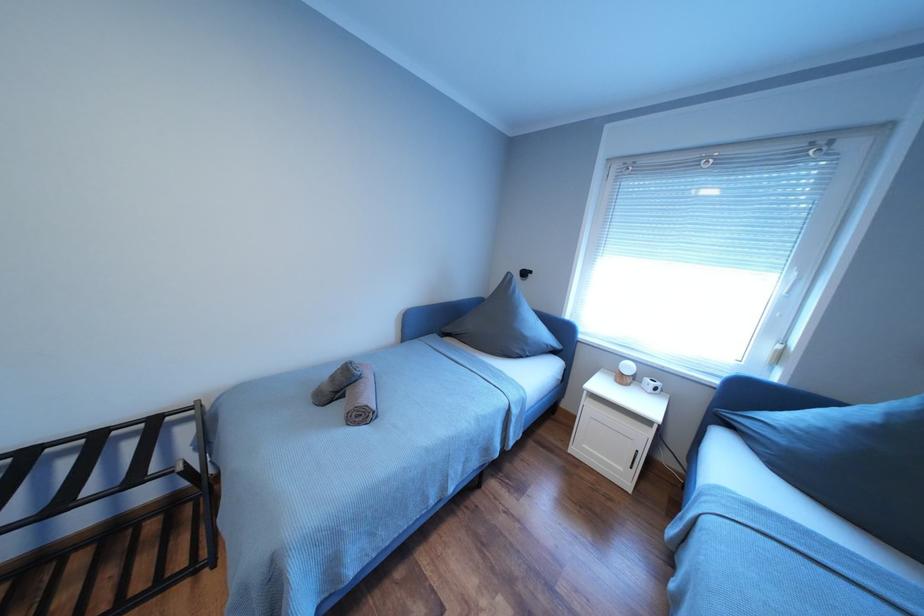
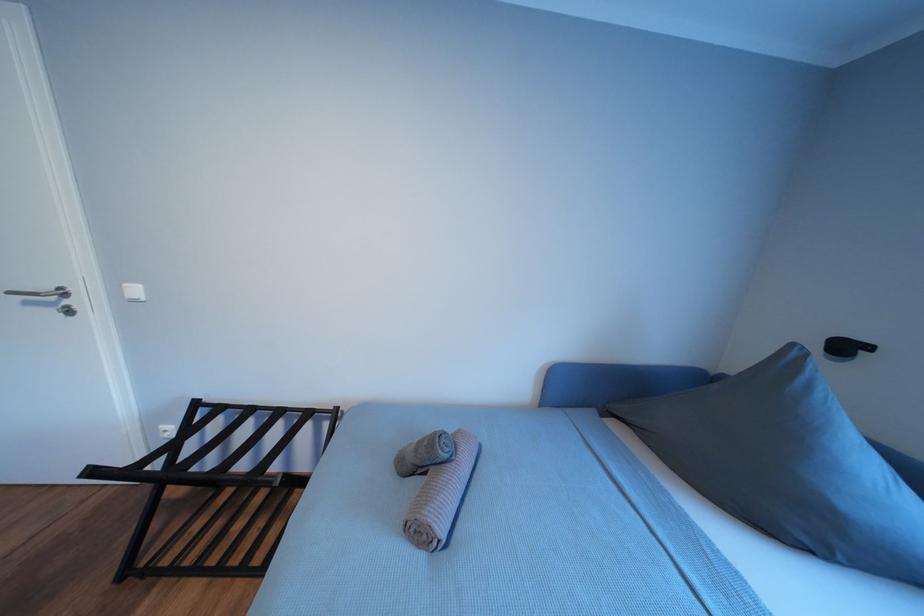
Question: The images are taken continuously from a first-person perspective. In which direction is your viewpoint rotating?

Choices:
 (A) Left
 (B) Right
 (C) Up
 (D) Down

Answer: (A)